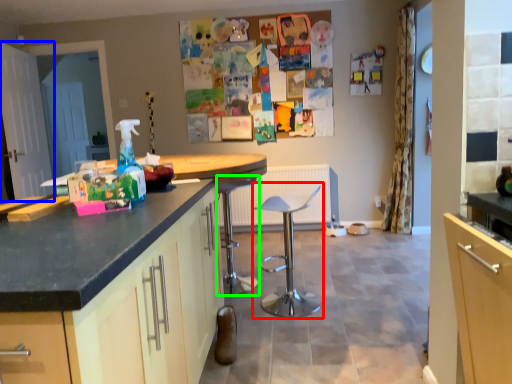
Question: Estimate the real-world distances between objects in this image. Which object is farther from swivel chair (highlighted by a red box), screen door (highlighted by a blue box) or bar stool (highlighted by a green box)?

Choices:
 (A) screen door
 (B) bar stool

Answer: (A)